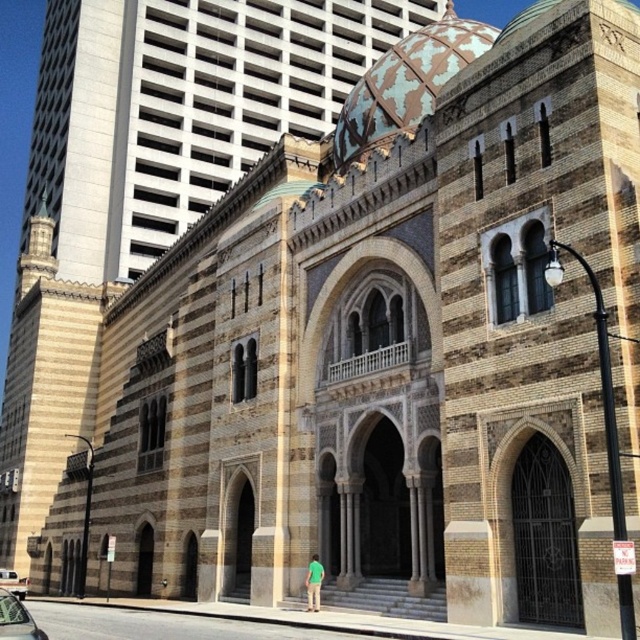
Can you confirm if metallic silver car at lower left is wider than silver metallic car at lower left?

No, metallic silver car at lower left is not wider than silver metallic car at lower left.

Between point (17, 628) and point (1, 579), which one is positioned behind?

Positioned behind is point (1, 579).

Identify the location of metallic silver car at lower left. Image resolution: width=640 pixels, height=640 pixels. (17, 620).